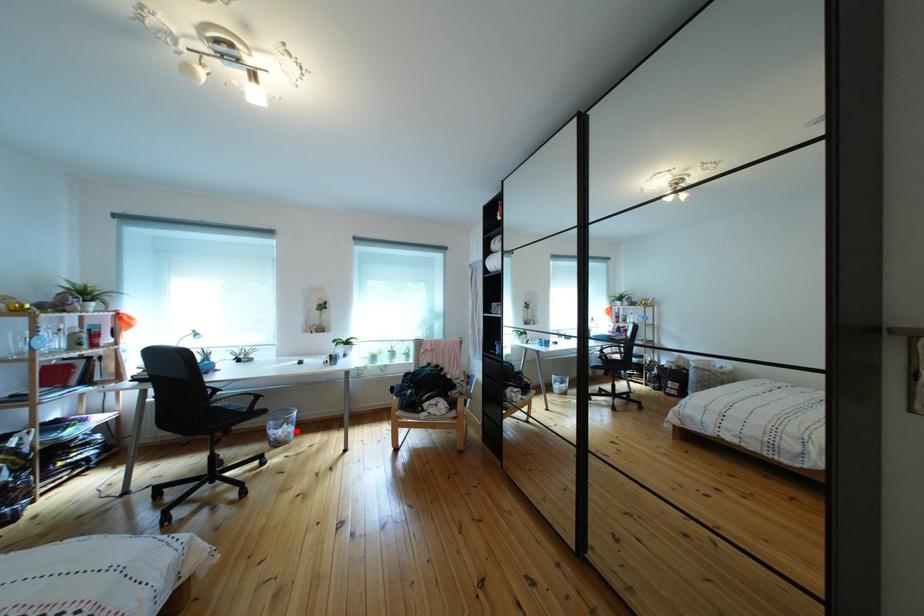
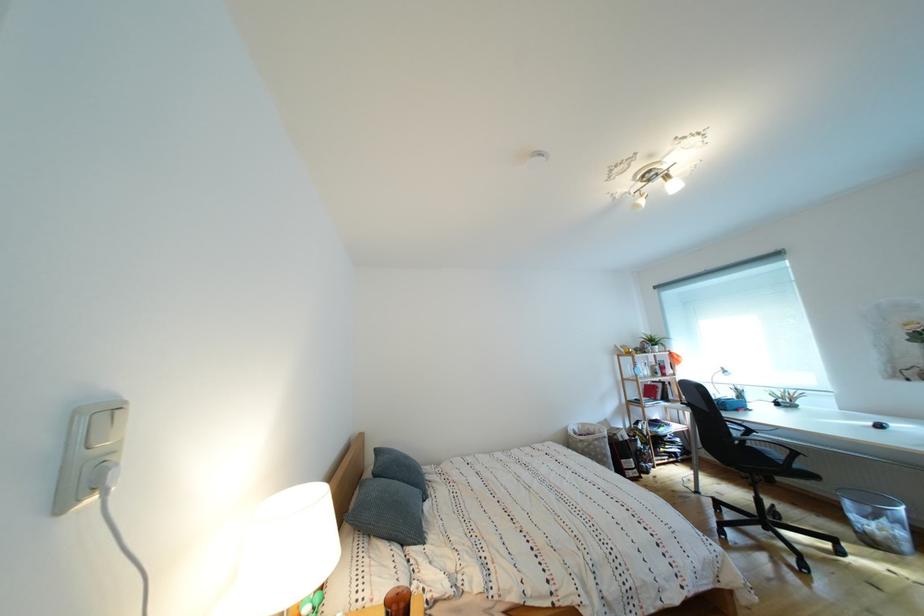
Where in the second image is the point corresponding to the highlighted location from the first image?

(896, 527)